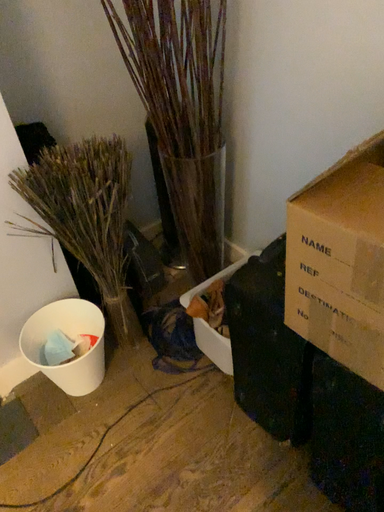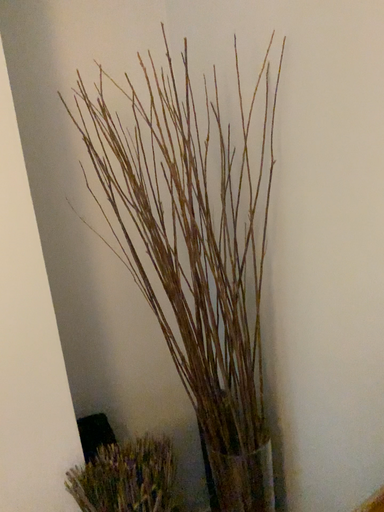
Question: Which way did the camera rotate in the video?

Choices:
 (A) rotated upward
 (B) rotated downward

Answer: (A)